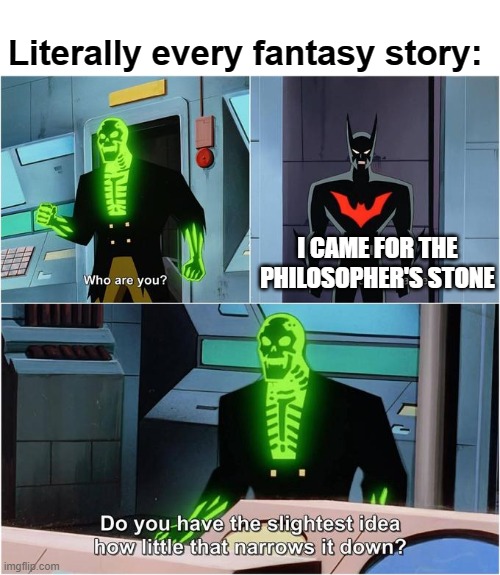
Find the location of a particular element. This screenshot has width=500, height=575. keypad is located at coordinates (14, 256).